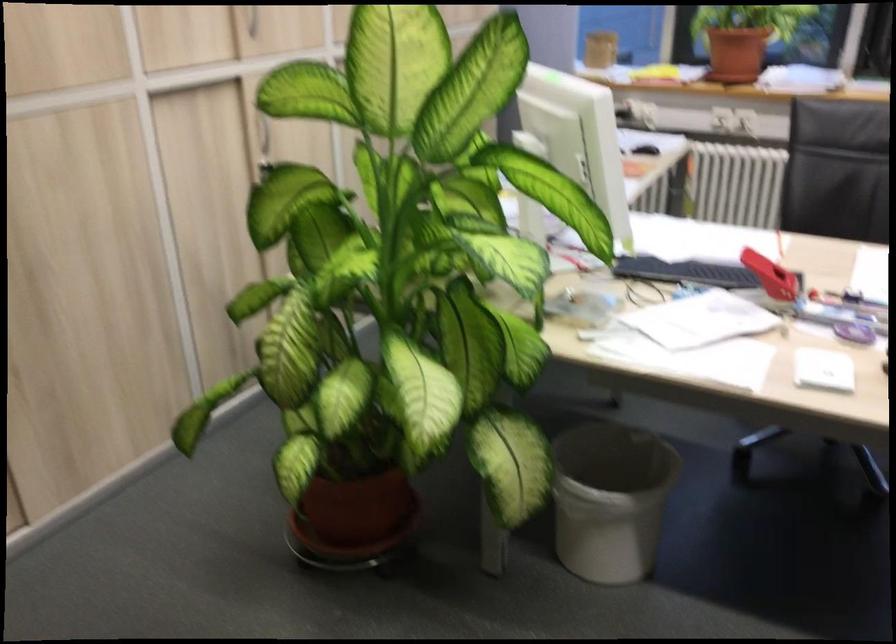
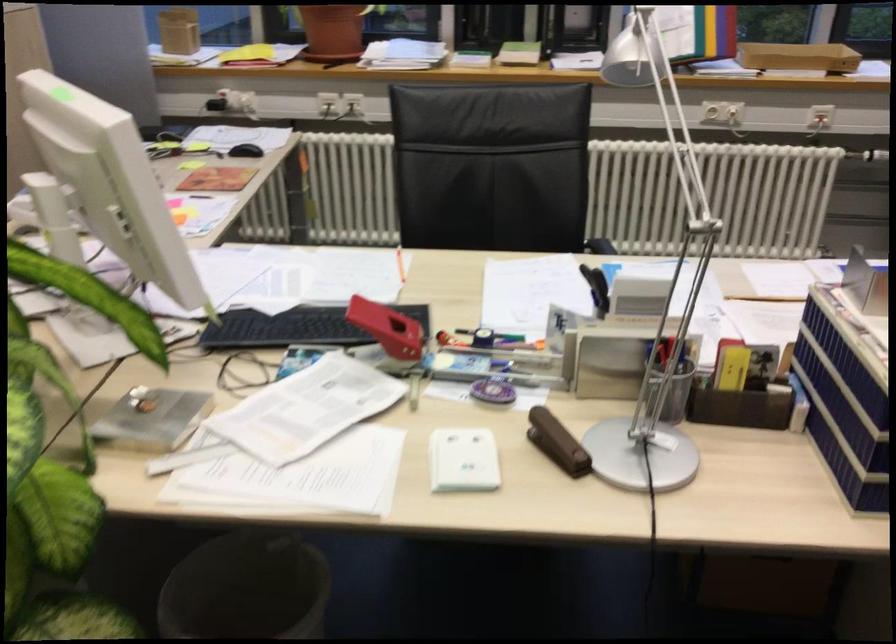
The point at (767, 272) is marked in the first image. Where is the corresponding point in the second image?

(386, 328)